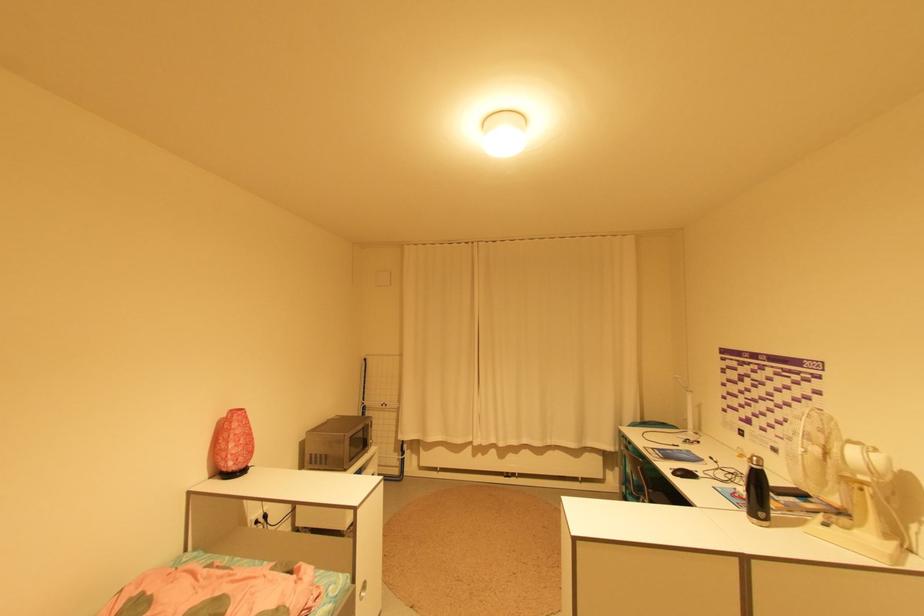
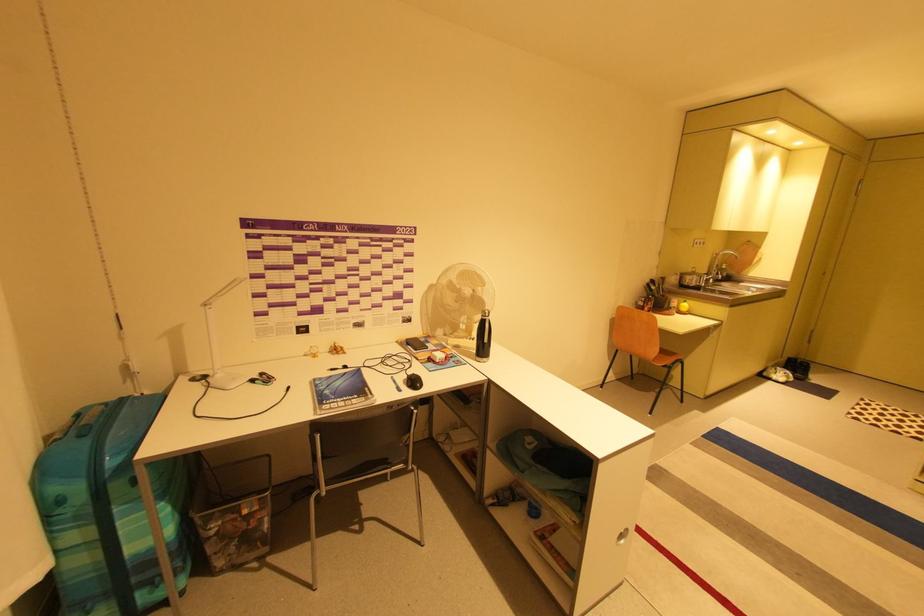
The point at (700, 456) is marked in the first image. Where is the corresponding point in the second image?

(336, 377)